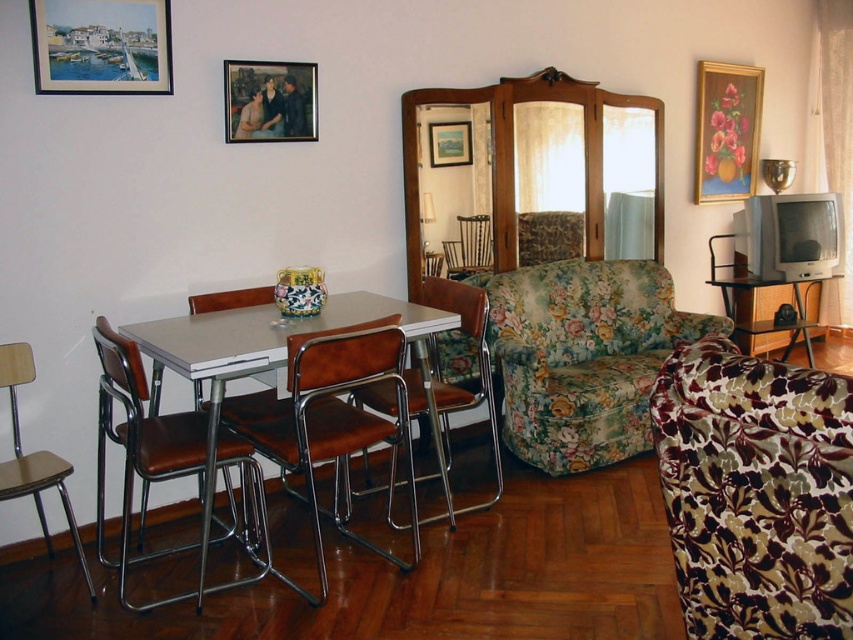
Question: Which point is farther to the camera?

Choices:
 (A) (740, 532)
 (B) (457, 400)
 (C) (102, 484)
 (D) (434, 157)

Answer: (D)

Question: Is floral fabric couch at lower right bigger than floral fabric couch at center?

Choices:
 (A) yes
 (B) no

Answer: (B)

Question: Based on their relative distances, which object is farther from the brown leather chair at left?

Choices:
 (A) wooden picture frame at upper left
 (B) gold-framed floral painting at upper right
 (C) brown leather armchair at center

Answer: (B)

Question: Which of the following is the closest to the observer?

Choices:
 (A) brown wood/chrome chair at left
 (B) wooden picture frame at center
 (C) floral fabric couch at lower right
 (D) floral fabric couch at center

Answer: (C)

Question: In this image, where is floral fabric couch at lower right located relative to brown leather chair at left?

Choices:
 (A) above
 (B) below

Answer: (A)

Question: Is gold-framed floral painting at upper right behind brown leather/chrome chair at center?

Choices:
 (A) no
 (B) yes

Answer: (B)